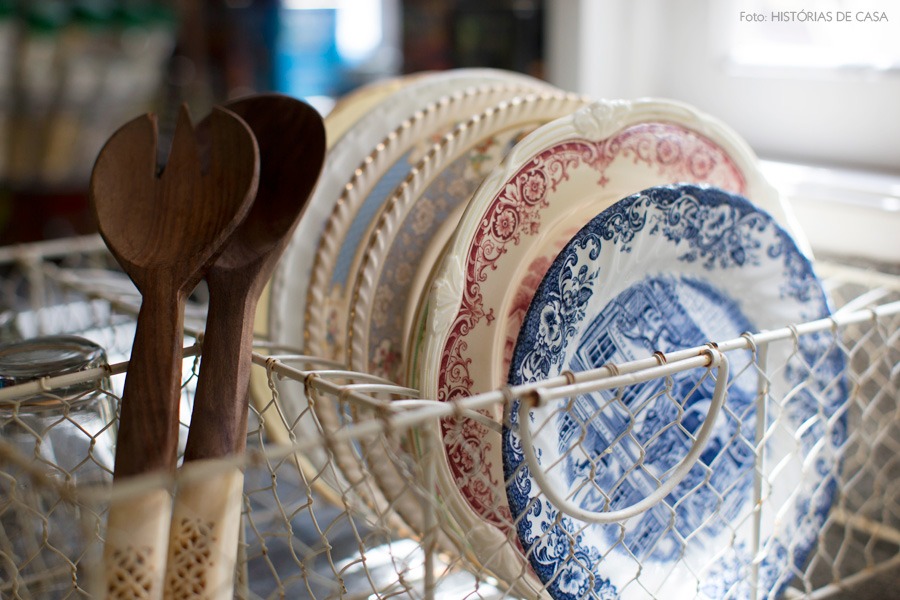
The image size is (900, 600). In order to click on plate in this screenshot , I will do `click(634, 306)`, `click(554, 188)`, `click(475, 148)`, `click(400, 140)`, `click(382, 121)`, `click(356, 102)`.